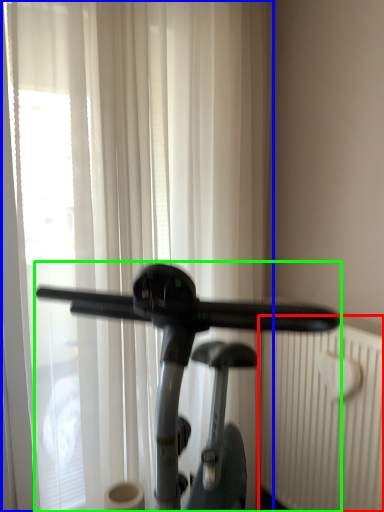
Question: Which object is the closest to the radiator (highlighted by a red box)? Choose among these: curtain (highlighted by a blue box) or stationary bicycle (highlighted by a green box).

Choices:
 (A) curtain
 (B) stationary bicycle

Answer: (B)